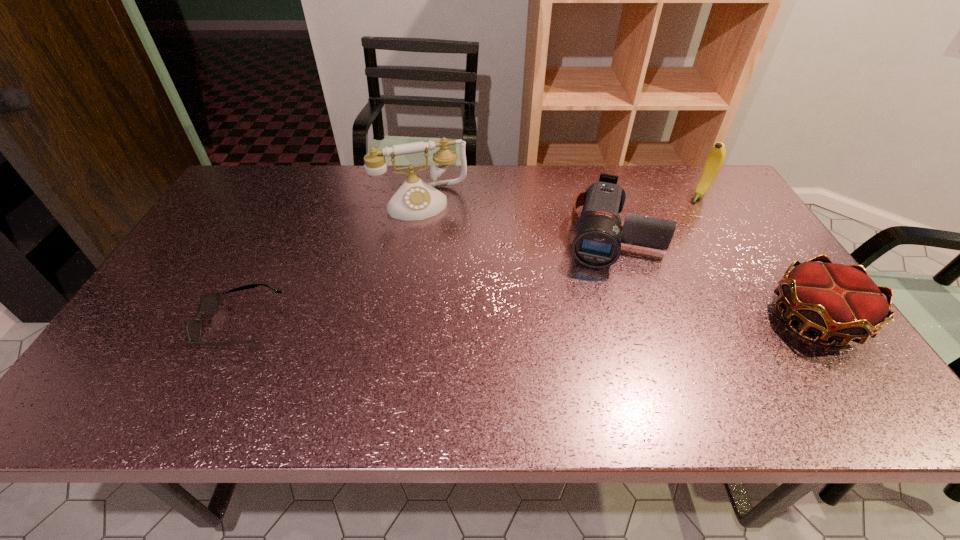
You are a GUI agent. You are given a task and a screenshot of the screen. Output one action in this format:
    pyautogui.click(x=<x>, y=<y>)
    Task: Click on the shortest object
    The height and width of the screenshot is (540, 960).
    Given the screenshot: What is the action you would take?
    pyautogui.click(x=208, y=305)

Where is `sunglasses`? sunglasses is located at coordinates (208, 305).

Identify the location of crown. (840, 301).

This screenshot has width=960, height=540. In order to click on telephone in this screenshot , I will do `click(415, 199)`.

The image size is (960, 540). What are the coordinates of `banana` in the screenshot? It's located at (715, 158).

Where is `camcorder`? The height and width of the screenshot is (540, 960). camcorder is located at coordinates (597, 244).

You are a GUI agent. You are given a task and a screenshot of the screen. Output one action in this format:
    pyautogui.click(x=<x>, y=<y>)
    Task: Click on the blank space located on the lenses of the leftmost object
    The height and width of the screenshot is (540, 960).
    Given the screenshot: What is the action you would take?
    pyautogui.click(x=168, y=326)

This screenshot has width=960, height=540. Identify the location of free space located 0.160m on the lenses of the leftmost object. (134, 326).

Locate an element on the screen. free point located 0.320m on the back of the crown is located at coordinates (741, 211).

Find the location of a particular element. The height and width of the screenshot is (540, 960). vacant area situated on the dial of the telephone is located at coordinates (442, 247).